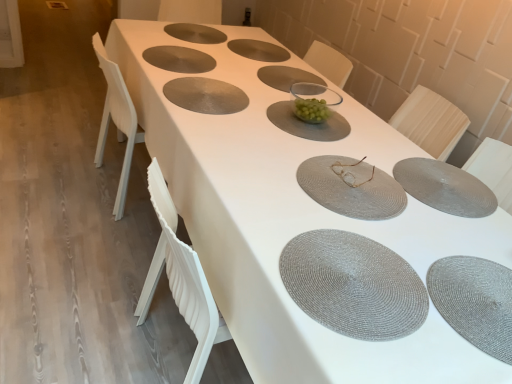
The height and width of the screenshot is (384, 512). Find the location of `space that is in front of gray woven placemat at center`. space that is in front of gray woven placemat at center is located at coordinates (271, 95).